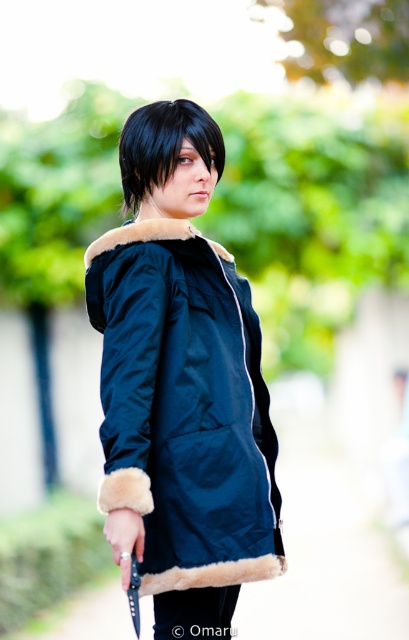
Question: Where is navy blue fur-lined jacket at center located in relation to black matte hair at center in the image?

Choices:
 (A) below
 (B) above

Answer: (A)

Question: Among these objects, which one is nearest to the camera?

Choices:
 (A) black matte hair at center
 (B) navy blue fur-lined jacket at center

Answer: (B)

Question: Is the position of navy blue fur-lined jacket at center more distant than that of black matte hair at center?

Choices:
 (A) no
 (B) yes

Answer: (A)

Question: Which of the following is the closest to the observer?

Choices:
 (A) (125, 122)
 (B) (242, 515)

Answer: (B)

Question: Which of the following is the farthest from the observer?

Choices:
 (A) (218, 544)
 (B) (125, 129)

Answer: (B)

Question: Does navy blue fur-lined jacket at center appear under black matte hair at center?

Choices:
 (A) yes
 (B) no

Answer: (A)